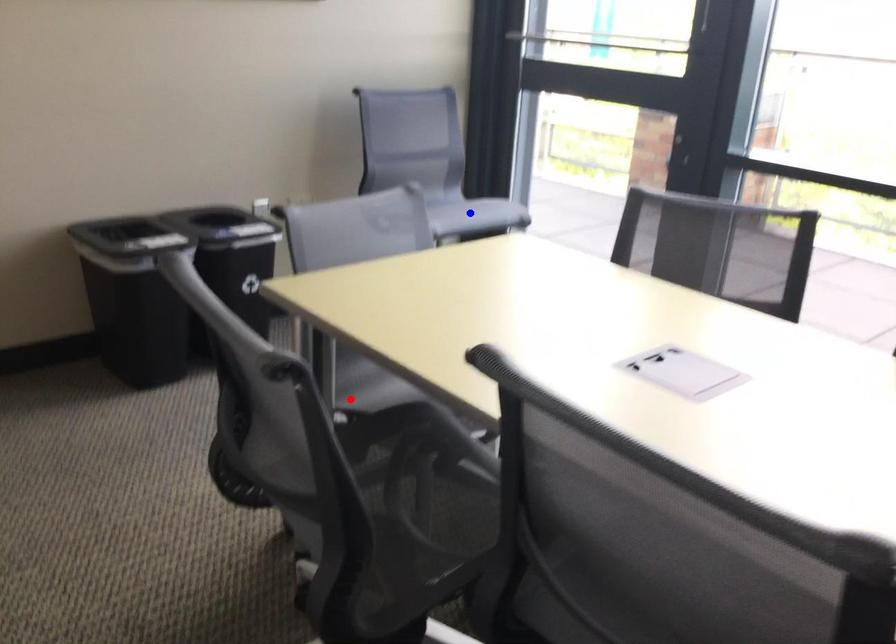
Question: Which of the two points in the image is closer to the camera?

Choices:
 (A) Blue point is closer.
 (B) Red point is closer.

Answer: (B)